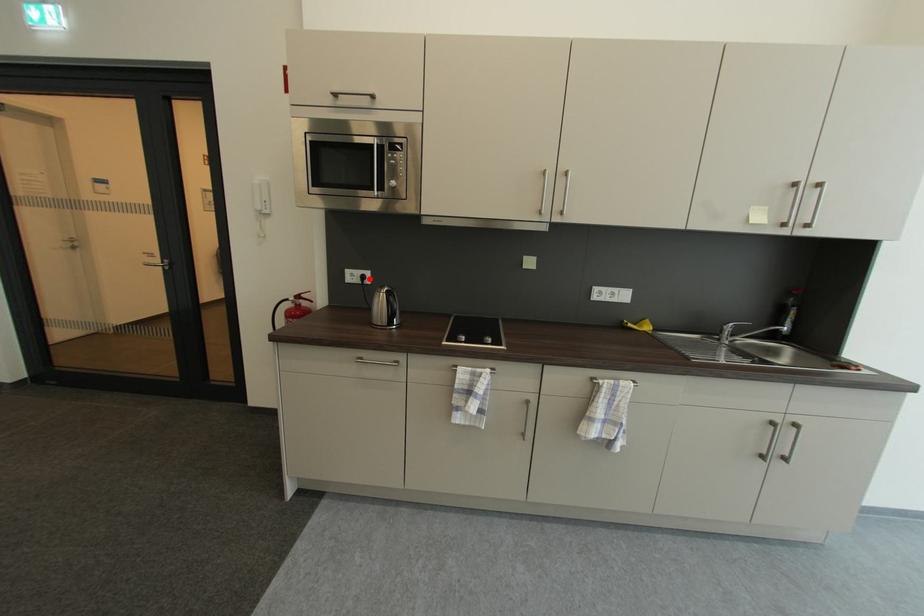
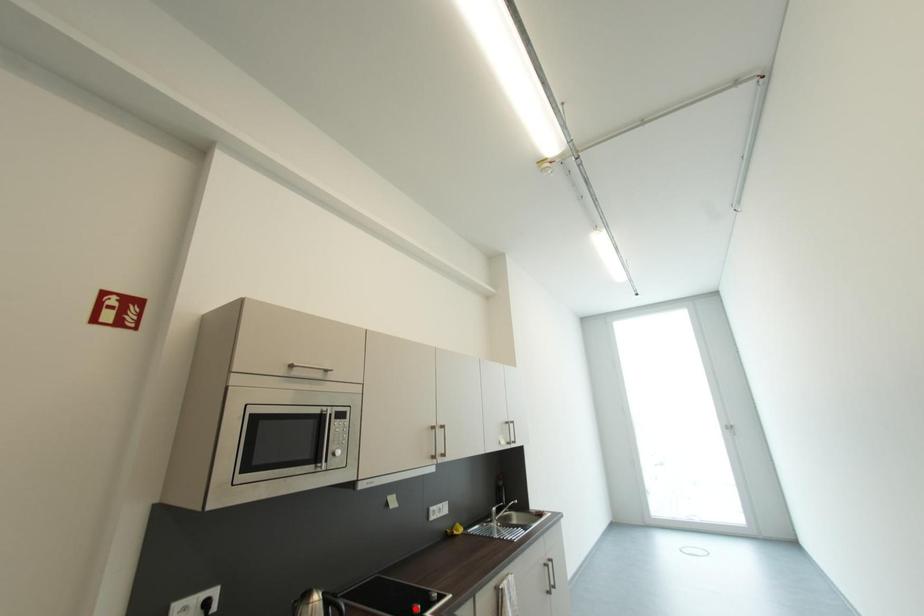
I am providing you with two images of the same scene from different viewpoints. A red point is marked on the first image and another point is marked on the second image. Does the point marked in image1 correspond to the same location as the one in image2?

No